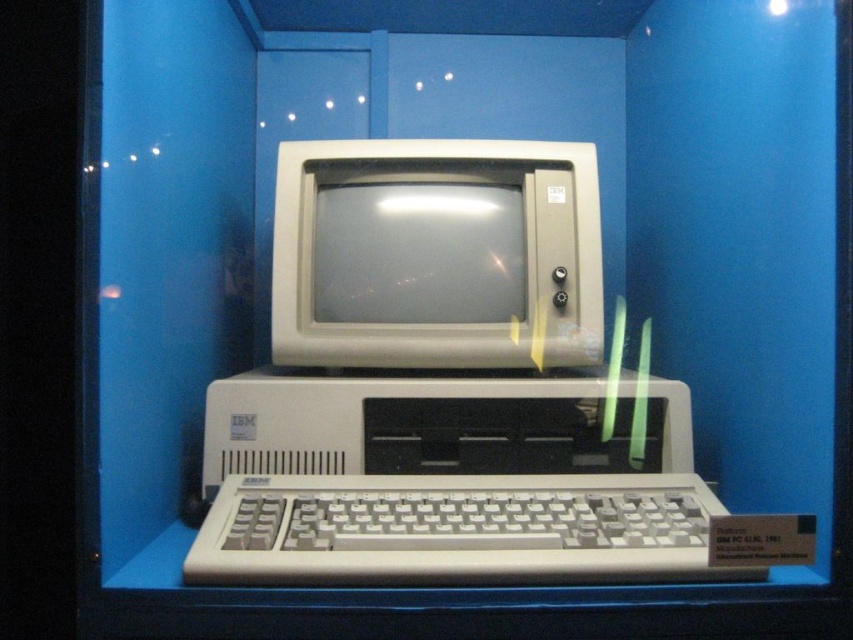
The image size is (853, 640). Identify the location of matte white desktop computer at center. (444, 387).

Is matte white desktop computer at center to the right of white plastic keyboard at center from the viewer's perspective?

Indeed, matte white desktop computer at center is positioned on the right side of white plastic keyboard at center.

Is point (572, 352) less distant than point (201, 557)?

No, it is behind (201, 557).

You are a GUI agent. You are given a task and a screenshot of the screen. Output one action in this format:
    pyautogui.click(x=<x>, y=<y>)
    Task: Click on the matte white desktop computer at center
    This screenshot has width=853, height=640.
    Given the screenshot: What is the action you would take?
    pyautogui.click(x=444, y=387)

Between beige plastic monitor at center and white plastic keyboard at center, which one appears on the right side from the viewer's perspective?

white plastic keyboard at center

Which is behind, point (315, 288) or point (689, 566)?

Positioned behind is point (315, 288).

Identify the location of beige plastic monitor at center. (436, 253).

Can you confirm if matte white desktop computer at center is positioned below beige plastic monitor at center?

Yes.

Which is behind, point (439, 508) or point (277, 202)?

The point (277, 202) is behind.

The height and width of the screenshot is (640, 853). Identify the location of matte white desktop computer at center. (444, 387).